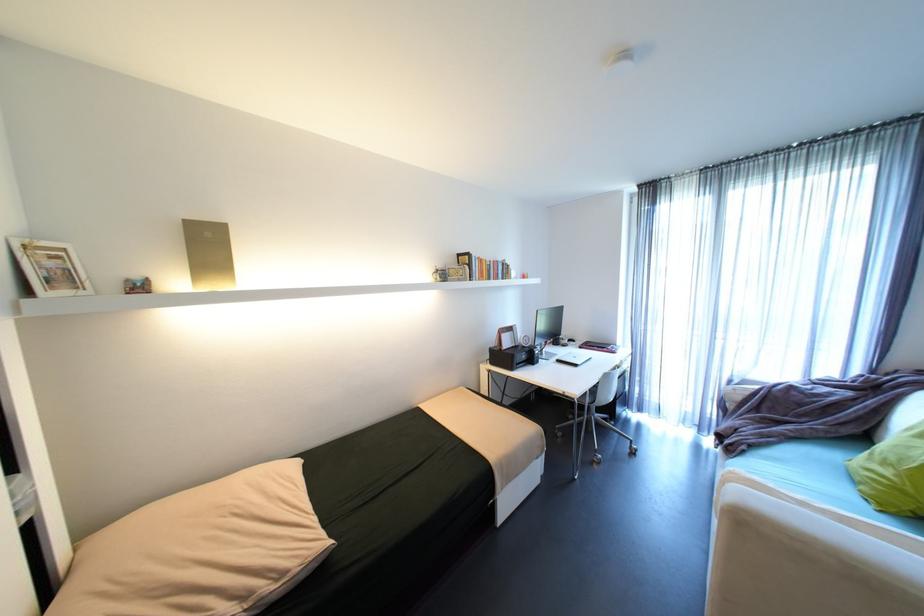
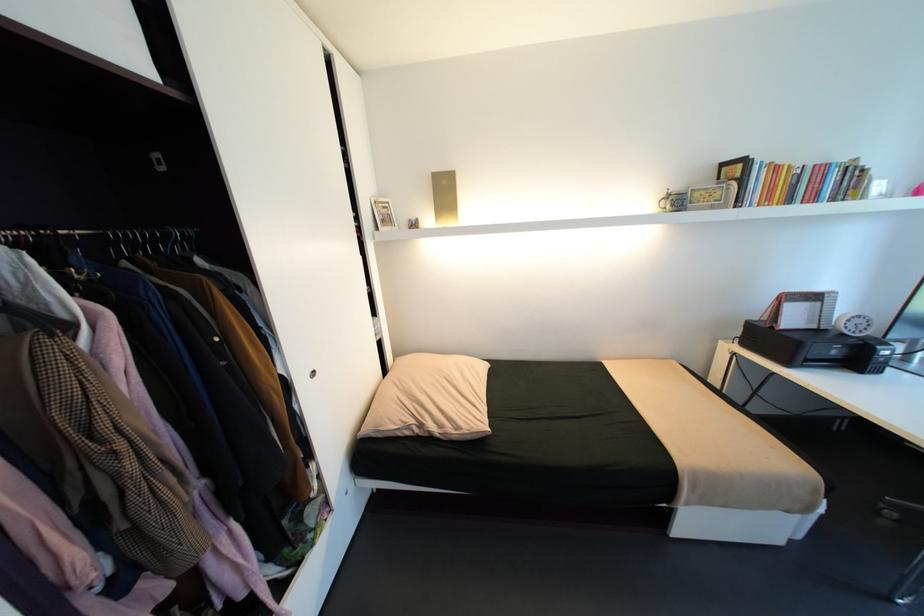
Question: Based on the continuous images, in which direction is the camera rotating? Reply with the corresponding letter.

Choices:
 (A) Left
 (B) Right
 (C) Up
 (D) Down

Answer: (A)